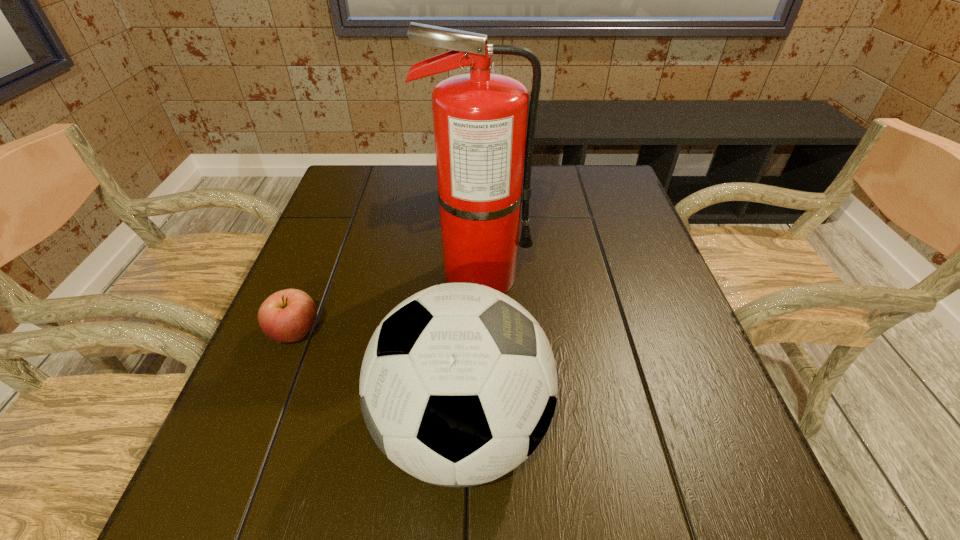
This screenshot has height=540, width=960. I want to click on the nearer fire extinguisher, so coord(480,118).

Locate an element on the screen. The height and width of the screenshot is (540, 960). the taller fire extinguisher is located at coordinates click(480, 118).

Locate an element on the screen. Image resolution: width=960 pixels, height=540 pixels. the farther fire extinguisher is located at coordinates (492, 70).

Where is `the shorter fire extinguisher`? Image resolution: width=960 pixels, height=540 pixels. the shorter fire extinguisher is located at coordinates (492, 70).

Identify the location of soccer ball. (458, 384).

The width and height of the screenshot is (960, 540). I want to click on the nearest object, so [x=458, y=384].

At what (x,y) coordinates should I click in order to perform the action: click on the third farthest object. Please return your answer as a coordinate pair (x, y). Looking at the image, I should click on (288, 315).

This screenshot has height=540, width=960. In order to click on the shortest object in this screenshot , I will do `click(288, 315)`.

Where is `vacant area situated at the nozzle of the taller fire extinguisher`? vacant area situated at the nozzle of the taller fire extinguisher is located at coordinates (598, 276).

Image resolution: width=960 pixels, height=540 pixels. In order to click on blank area located 0.190m on the front of the shorter fire extinguisher near the operation label in this screenshot , I will do `click(563, 193)`.